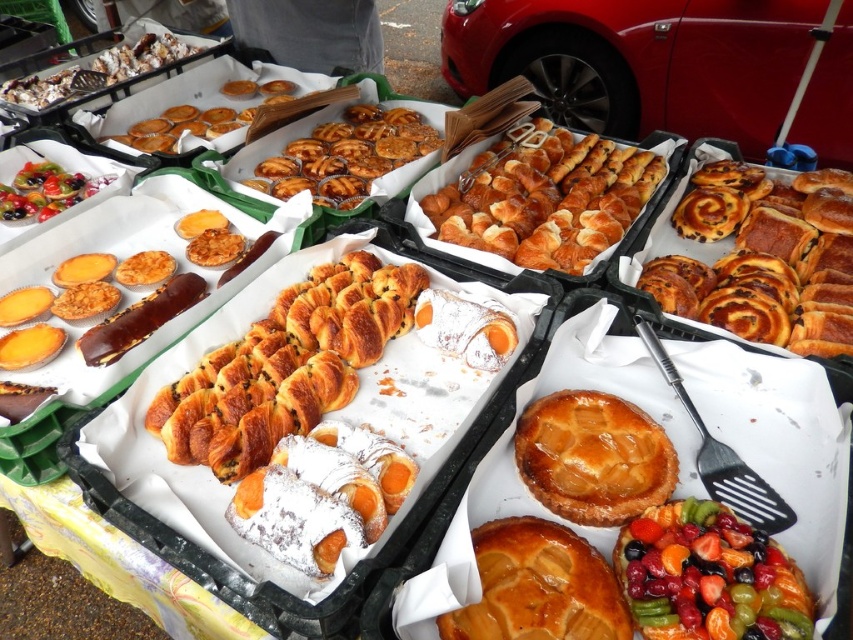
Between point (817, 211) and point (636, 572), which one is positioned behind?

The point (817, 211) is behind.

Who is more forward, [675,280] or [735,604]?

Point [735,604]

Does point (822, 285) come closer to viewer compared to point (688, 538)?

No, (822, 285) is further to viewer.

Image resolution: width=853 pixels, height=640 pixels. Find the location of `golden brown dough at right`. golden brown dough at right is located at coordinates (762, 264).

Does point (631, 221) lie behind point (624, 460)?

Yes, it is.

Is golden brown croissant at center wider than golden glazed tart at center?

Correct, the width of golden brown croissant at center exceeds that of golden glazed tart at center.

I want to click on golden brown croissant at center, so click(x=548, y=200).

Find the location of a particular element. The height and width of the screenshot is (640, 853). golden brown croissant at center is located at coordinates (548, 200).

Who is lower down, golden brown flaky croissant at center or golden brown croissant at center?

Positioned lower is golden brown flaky croissant at center.

Is point (260, 396) closer to camera compared to point (552, 221)?

Yes, it is in front of point (552, 221).

You are a GUI agent. You are given a task and a screenshot of the screen. Output one action in this format:
    pyautogui.click(x=<x>, y=<y>)
    Task: Click on the golden brown flaky croissant at center
    This screenshot has height=640, width=853.
    Given the screenshot: What is the action you would take?
    (286, 365)